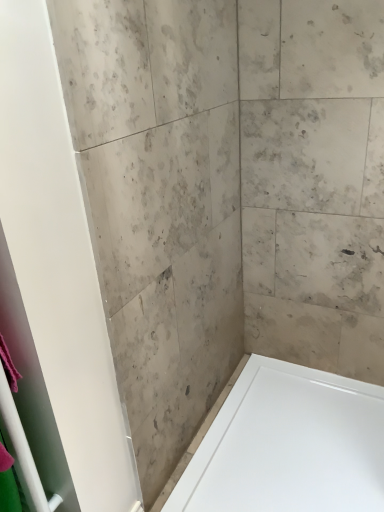
In order to face pink fabric at left, should I rotate leftwards or rightwards?

A 25.043 degree turn to the left will do.

Find the location of a particular element. pink fabric at left is located at coordinates (33, 389).

Describe the element at coordinates (33, 389) in the screenshot. I see `pink fabric at left` at that location.

Measure the distance between point (236, 484) and camera.

Point (236, 484) and camera are 4.75 feet apart from each other.

Find the location of a particular element. Image resolution: width=384 pixels, height=512 pixels. white glossy bathtub at lower right is located at coordinates (289, 445).

Describe the element at coordinates (289, 445) in the screenshot. I see `white glossy bathtub at lower right` at that location.

The image size is (384, 512). I want to click on pink fabric at left, so click(x=33, y=389).

Considering the positions of objects white glossy bathtub at lower right and pink fabric at left in the image provided, who is more to the left, white glossy bathtub at lower right or pink fabric at left?

pink fabric at left.

Considering the positions of objects white glossy bathtub at lower right and pink fabric at left in the image provided, who is behind, white glossy bathtub at lower right or pink fabric at left?

white glossy bathtub at lower right is further from the camera.

Which is in front, point (231, 416) or point (49, 488)?

Positioned in front is point (49, 488).

From the image's perspective, would you say white glossy bathtub at lower right is shown under pink fabric at left?

Yes.

From a real-world perspective, is white glossy bathtub at lower right above or below pink fabric at left?

From a real-world perspective, white glossy bathtub at lower right is physically below pink fabric at left.

Which object is wider, white glossy bathtub at lower right or pink fabric at left?

With larger width is white glossy bathtub at lower right.

From their relative heights in the image, would you say white glossy bathtub at lower right is taller or shorter than pink fabric at left?

In the image, white glossy bathtub at lower right appears to be shorter than pink fabric at left.

Based on the photo, considering the sizes of objects white glossy bathtub at lower right and pink fabric at left in the image provided, who is bigger, white glossy bathtub at lower right or pink fabric at left?

white glossy bathtub at lower right is bigger.

Is white glossy bathtub at lower right not inside pink fabric at left?

Indeed, white glossy bathtub at lower right is completely outside pink fabric at left.

Is white glossy bathtub at lower right far away from pink fabric at left?

white glossy bathtub at lower right is actually quite close to pink fabric at left.

Could you tell me if white glossy bathtub at lower right is turned towards pink fabric at left?

No, white glossy bathtub at lower right is not facing towards pink fabric at left.

Can you tell me how much white glossy bathtub at lower right and pink fabric at left differ in facing direction?

0.363 degrees.

Find the location of a particular element. Image resolution: width=384 pixels, height=512 pixels. screen door in front of the white glossy bathtub at lower right is located at coordinates (33, 389).

Between pink fabric at left and white glossy bathtub at lower right, which one appears on the right side from the viewer's perspective?

white glossy bathtub at lower right.

Considering the positions of objects pink fabric at left and white glossy bathtub at lower right in the image provided, who is in front, pink fabric at left or white glossy bathtub at lower right?

Positioned in front is pink fabric at left.

Which is behind, point (8, 265) or point (336, 466)?

Positioned behind is point (336, 466).

From the image's perspective, which is below, pink fabric at left or white glossy bathtub at lower right?

white glossy bathtub at lower right, from the image's perspective.

From the picture: From a real-world perspective, relative to white glossy bathtub at lower right, is pink fabric at left vertically above or below?

Clearly, from a real-world perspective, pink fabric at left is above white glossy bathtub at lower right.

Between pink fabric at left and white glossy bathtub at lower right, which one has smaller width?

pink fabric at left.

Between pink fabric at left and white glossy bathtub at lower right, which one has more height?

Standing taller between the two is pink fabric at left.

Which of these two, pink fabric at left or white glossy bathtub at lower right, is smaller?

pink fabric at left is smaller.

Would you say white glossy bathtub at lower right is part of pink fabric at left's contents?

Definitely not — white glossy bathtub at lower right is not inside pink fabric at left.

In the scene shown: Is pink fabric at left far away from white glossy bathtub at lower right?

No, there isn't a large distance between pink fabric at left and white glossy bathtub at lower right.

Is pink fabric at left oriented away from white glossy bathtub at lower right?

pink fabric at left does not have its back to white glossy bathtub at lower right.

Looking at this image, measure the distance from pink fabric at left to white glossy bathtub at lower right.

A distance of 82.50 centimeters exists between pink fabric at left and white glossy bathtub at lower right.

Where is `bathtub that is under the pink fabric at left (from a real-world perspective)`? bathtub that is under the pink fabric at left (from a real-world perspective) is located at coordinates (289, 445).

Identify the location of screen door that is in front of the white glossy bathtub at lower right. This screenshot has width=384, height=512. (33, 389).

Identify the location of screen door above the white glossy bathtub at lower right (from the image's perspective). (33, 389).